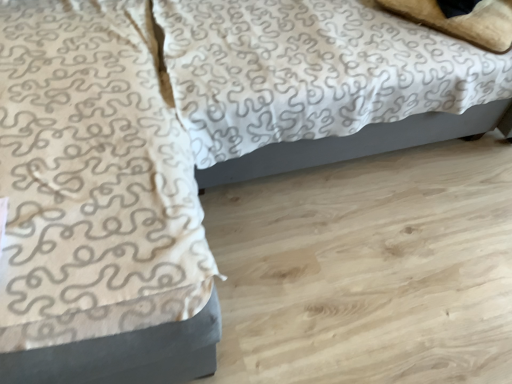
This screenshot has width=512, height=384. In order to click on free space above white textured blanket at upper left (from a real-world perspective) in this screenshot , I will do `click(82, 104)`.